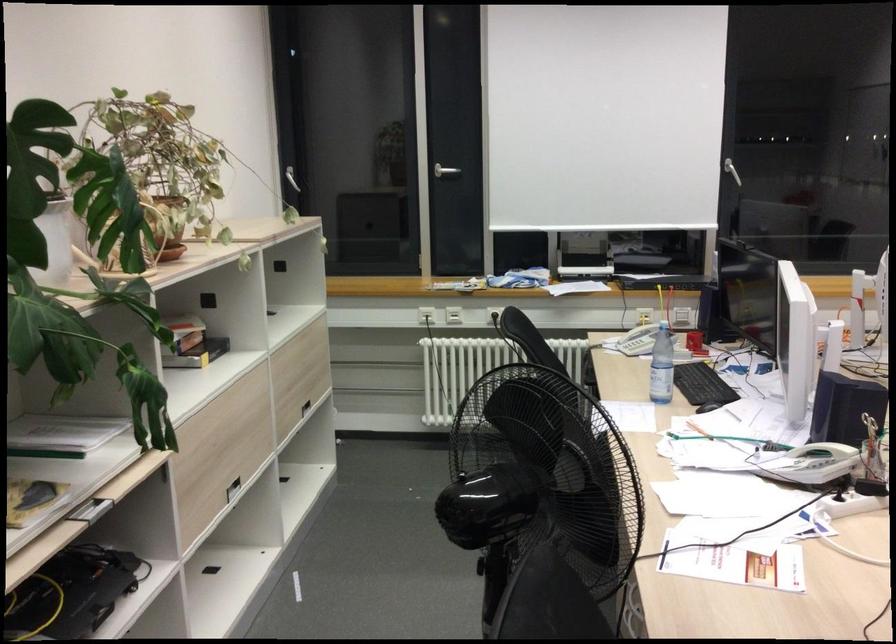
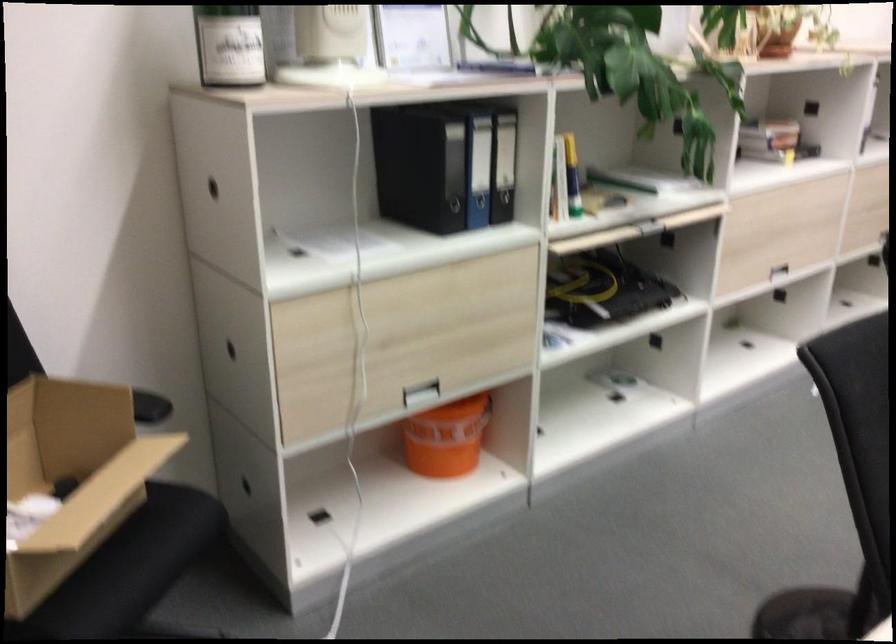
Find the pixel in the second image that matches (x=236, y=483) in the first image.

(771, 266)